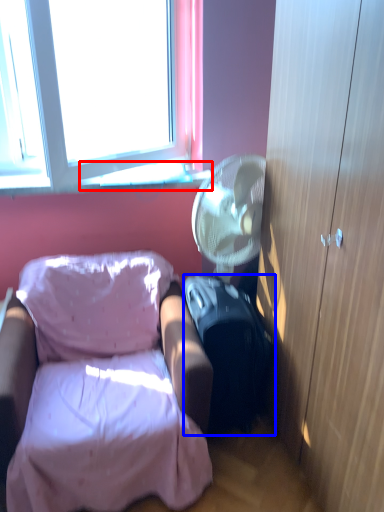
Question: Among these objects, which one is nearest to the camera, window sill (highlighted by a red box) or suitcase (highlighted by a blue box)?

Choices:
 (A) window sill
 (B) suitcase

Answer: (B)